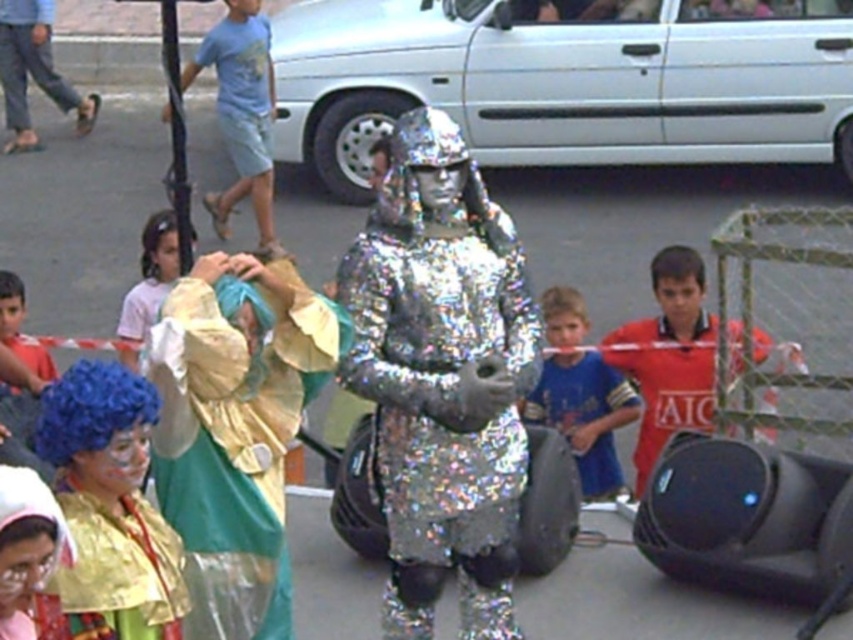
Question: Is shiny gold costume at lower left smaller than light pink fabric at upper left?

Choices:
 (A) yes
 (B) no

Answer: (A)

Question: Which point appears farthest from the camera in this image?

Choices:
 (A) (705, 38)
 (B) (465, 502)
 (C) (41, 12)
 (D) (740, 339)

Answer: (C)

Question: Does gold shiny fabric at center appear under gold sequined costume at lower left?

Choices:
 (A) yes
 (B) no

Answer: (B)

Question: Among these objects, which one is nearest to the camera?

Choices:
 (A) holographic metallic robot at center
 (B) holographic foil suit at center
 (C) gold shiny fabric at center

Answer: (C)

Question: Does gold sequined costume at lower left appear on the right side of shiny gold costume at lower left?

Choices:
 (A) no
 (B) yes

Answer: (B)

Question: Among these points, which one is farthest from the camera?

Choices:
 (A) (183, 500)
 (B) (480, 125)
 (C) (566, 336)
 (D) (9, 512)

Answer: (B)